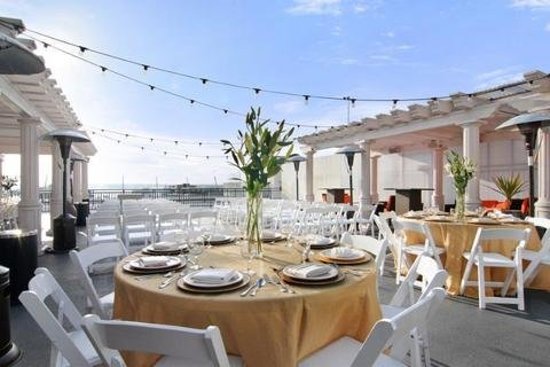
I want to click on lights, so click(x=56, y=135), click(x=73, y=157), click(x=346, y=152), click(x=300, y=157), click(x=521, y=125).